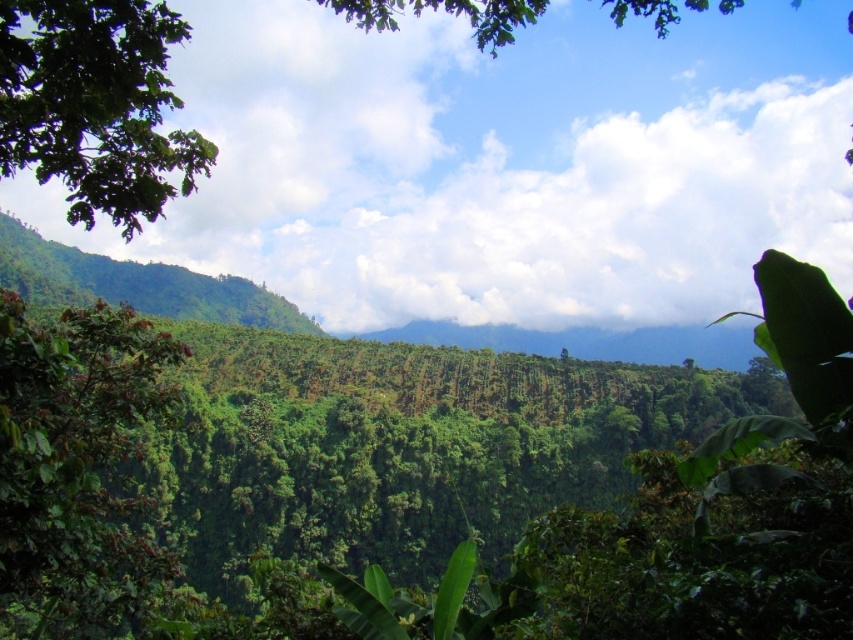
Question: Is green leafy tree at left wider than green leafy tree at upper left?

Choices:
 (A) yes
 (B) no

Answer: (B)

Question: From the image, what is the correct spatial relationship of green leafy tree at left in relation to green leafy tree at upper left?

Choices:
 (A) right
 (B) left

Answer: (A)

Question: Does green leafy tree at left lie behind green leafy tree at upper left?

Choices:
 (A) no
 (B) yes

Answer: (B)